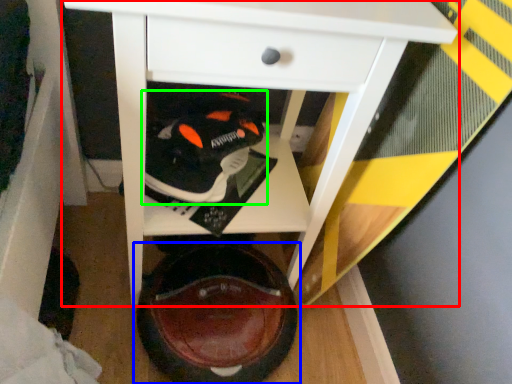
Question: Which object is positioned farthest from table (highlighted by a red box)? Select from footwear (highlighted by a blue box) and footwear (highlighted by a green box).

Choices:
 (A) footwear
 (B) footwear

Answer: (A)